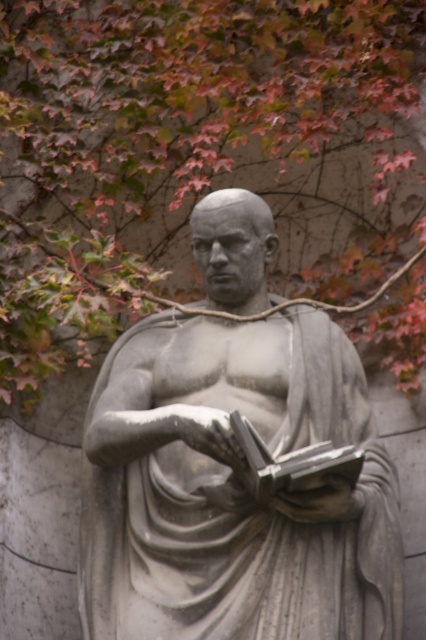
Question: Is green leafy tree at upper center to the left of matte gray stone book at center from the viewer's perspective?

Choices:
 (A) yes
 (B) no

Answer: (A)

Question: Which point is closer to the camera?

Choices:
 (A) (298, 467)
 (B) (207, 557)
 (C) (325, 257)

Answer: (A)

Question: Can you confirm if green leafy tree at upper center is positioned above gray stone statue at center?

Choices:
 (A) no
 (B) yes

Answer: (B)

Question: Does gray stone statue at center appear on the right side of matte gray stone book at center?

Choices:
 (A) no
 (B) yes

Answer: (A)

Question: Which of the following is the farthest from the observer?

Choices:
 (A) (2, 280)
 (B) (268, 486)
 (C) (195, 563)

Answer: (A)

Question: Which point appears closest to the camera in this image?

Choices:
 (A) (294, 481)
 (B) (391, 522)

Answer: (A)